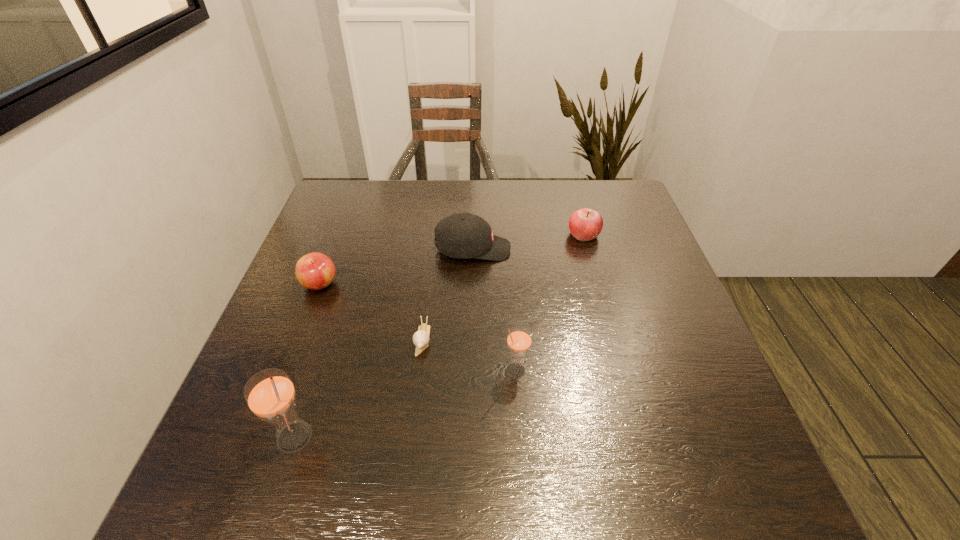
Locate an element on the screen. The image size is (960, 540). the fourth farthest object is located at coordinates (421, 337).

Where is `free space located on the right of the taller straw`? This screenshot has width=960, height=540. free space located on the right of the taller straw is located at coordinates (348, 437).

Locate an element on the screen. The height and width of the screenshot is (540, 960). vacant point located 0.290m on the right of the shorter straw is located at coordinates (668, 369).

Where is `vacant region located with a logo on the front of the baseball cap`? vacant region located with a logo on the front of the baseball cap is located at coordinates (617, 249).

Find the location of a particular element. free space located on the front of the left apple is located at coordinates (279, 391).

Identify the location of vacant area located 0.400m on the front of the farther apple. (620, 365).

The image size is (960, 540). In order to click on vacant position located on the shell of the shortest object in this screenshot , I will do `click(411, 437)`.

At what (x,y) coordinates should I click in order to perform the action: click on object that is at the near edge. Please return your answer as a coordinate pair (x, y). The width and height of the screenshot is (960, 540). Looking at the image, I should click on click(270, 394).

The height and width of the screenshot is (540, 960). Find the location of `straw that is at the left edge`. straw that is at the left edge is located at coordinates (270, 394).

Find the location of a particular element. The width and height of the screenshot is (960, 540). apple at the left edge is located at coordinates (315, 271).